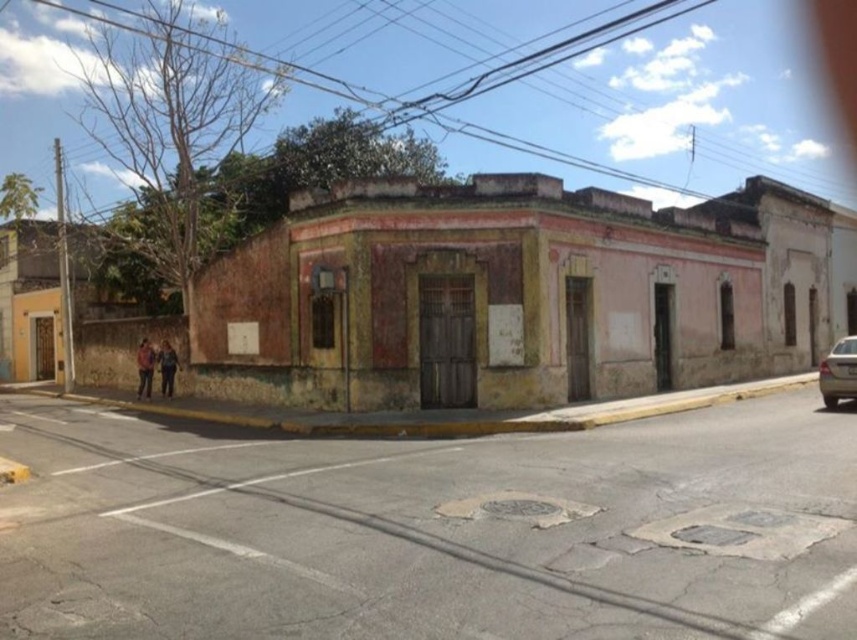
Question: Based on their relative distances, which object is nearer to the orange fabric jacket at lower left?

Choices:
 (A) dark blue jeans at lower left
 (B) gold metallic car at right

Answer: (A)

Question: Which point is closer to the camera?

Choices:
 (A) dark blue jeans at lower left
 (B) gold metallic car at right
 (C) orange fabric jacket at lower left

Answer: (B)

Question: Which of the following is the farthest from the observer?

Choices:
 (A) dark blue jeans at lower left
 (B) orange fabric jacket at lower left

Answer: (B)

Question: Is orange fabric jacket at lower left above dark blue jeans at lower left?

Choices:
 (A) no
 (B) yes

Answer: (A)

Question: Can you confirm if orange fabric jacket at lower left is positioned to the right of dark blue jeans at lower left?

Choices:
 (A) yes
 (B) no

Answer: (B)

Question: Does gold metallic car at right lie in front of dark blue jeans at lower left?

Choices:
 (A) yes
 (B) no

Answer: (A)